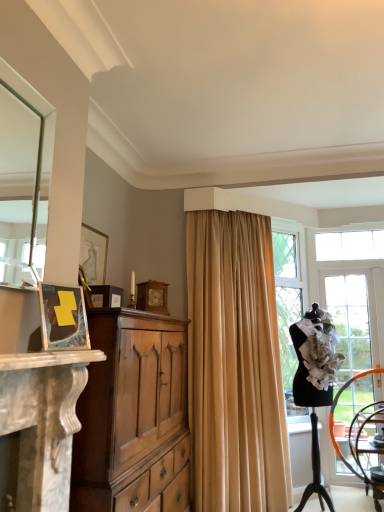
Question: Is black mannequin at right outside of matte black picture frame at left, the first picture frame when ordered from front to back?

Choices:
 (A) no
 (B) yes

Answer: (B)

Question: Can you confirm if black mannequin at right is shorter than matte black picture frame at left, the first picture frame when ordered from front to back?

Choices:
 (A) yes
 (B) no

Answer: (B)

Question: Considering the relative positions of black mannequin at right and matte black picture frame at left, the 4th picture frame from the back, in the image provided, is black mannequin at right behind matte black picture frame at left, the 4th picture frame from the back,?

Choices:
 (A) no
 (B) yes

Answer: (B)

Question: Can you confirm if black mannequin at right is positioned to the right of matte black picture frame at left, the first picture frame when ordered from front to back?

Choices:
 (A) yes
 (B) no

Answer: (A)

Question: Does black mannequin at right have a lesser width compared to matte black picture frame at left, the 4th picture frame from the back?

Choices:
 (A) no
 (B) yes

Answer: (A)

Question: From a real-world perspective, relative to black mannequin at right, is wooden clock at center, positioned as the first picture frame in back-to-front order, vertically above or below?

Choices:
 (A) below
 (B) above

Answer: (B)

Question: From the image's perspective, relative to black mannequin at right, is wooden clock at center, the 4th picture frame from the front, above or below?

Choices:
 (A) above
 (B) below

Answer: (A)

Question: Considering the relative positions of wooden clock at center, positioned as the first picture frame in back-to-front order, and black mannequin at right in the image provided, is wooden clock at center, positioned as the first picture frame in back-to-front order, to the left or to the right of black mannequin at right?

Choices:
 (A) right
 (B) left

Answer: (B)

Question: Is point (148, 280) closer or farther from the camera than point (322, 430)?

Choices:
 (A) farther
 (B) closer

Answer: (B)

Question: From the image's perspective, is clear glass door at right above or below light brown wood cabinet at left?

Choices:
 (A) below
 (B) above

Answer: (A)

Question: Is clear glass door at right spatially inside light brown wood cabinet at left, or outside of it?

Choices:
 (A) inside
 (B) outside

Answer: (B)

Question: In terms of height, does clear glass door at right look taller or shorter compared to light brown wood cabinet at left?

Choices:
 (A) short
 (B) tall

Answer: (B)

Question: Considering the positions of clear glass door at right and light brown wood cabinet at left in the image, is clear glass door at right wider or thinner than light brown wood cabinet at left?

Choices:
 (A) wide
 (B) thin

Answer: (B)

Question: Which is correct: black mannequin at right is inside matte black picture frame at left, the first picture frame when ordered from front to back, or outside of it?

Choices:
 (A) inside
 (B) outside

Answer: (B)

Question: Considering the positions of black mannequin at right and matte black picture frame at left, the first picture frame when ordered from front to back, in the image, is black mannequin at right wider or thinner than matte black picture frame at left, the first picture frame when ordered from front to back,?

Choices:
 (A) wide
 (B) thin

Answer: (A)